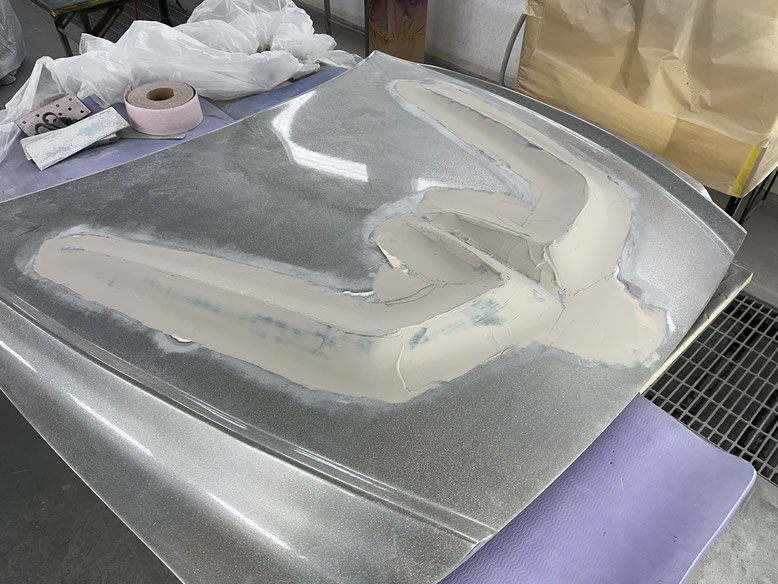
Image resolution: width=778 pixels, height=584 pixels. Find the location of `vent`. vent is located at coordinates (738, 350).